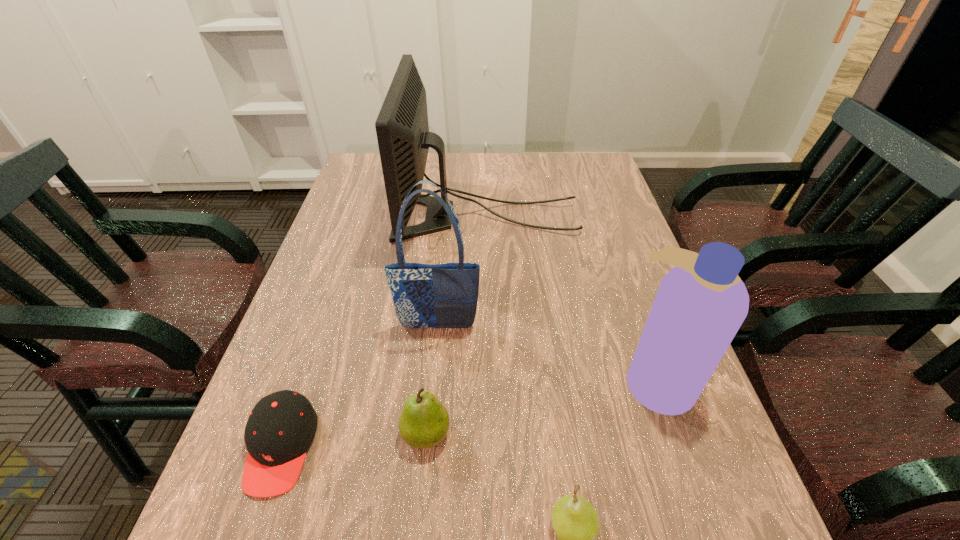
At what (x,y) coordinates should I click in order to perform the action: click on vacant area situated on the back of the shampoo. Please return your answer as a coordinate pair (x, y). Looking at the image, I should click on (623, 284).

The width and height of the screenshot is (960, 540). I want to click on free point located on the right of the farther pear, so click(533, 434).

Identify the location of object present at the far edge. (402, 128).

You are a GUI agent. You are given a task and a screenshot of the screen. Output one action in this format:
    pyautogui.click(x=<x>, y=<y>)
    Task: Click on the object that is at the left edge
    
    Given the screenshot: What is the action you would take?
    pyautogui.click(x=281, y=427)

What are the coordinates of `computer monitor that is at the right edge` in the screenshot? It's located at (402, 128).

In order to click on shampoo that is at the right edge in this screenshot , I will do `click(701, 303)`.

Locate an element on the screen. The width and height of the screenshot is (960, 540). object that is at the far right corner is located at coordinates (402, 128).

Where is `vacant region at the far edge of the desktop`? This screenshot has width=960, height=540. vacant region at the far edge of the desktop is located at coordinates (539, 172).

Image resolution: width=960 pixels, height=540 pixels. In order to click on blank space at the left edge in this screenshot , I will do `click(308, 291)`.

Where is `free space at the right edge of the desktop`? free space at the right edge of the desktop is located at coordinates (641, 443).